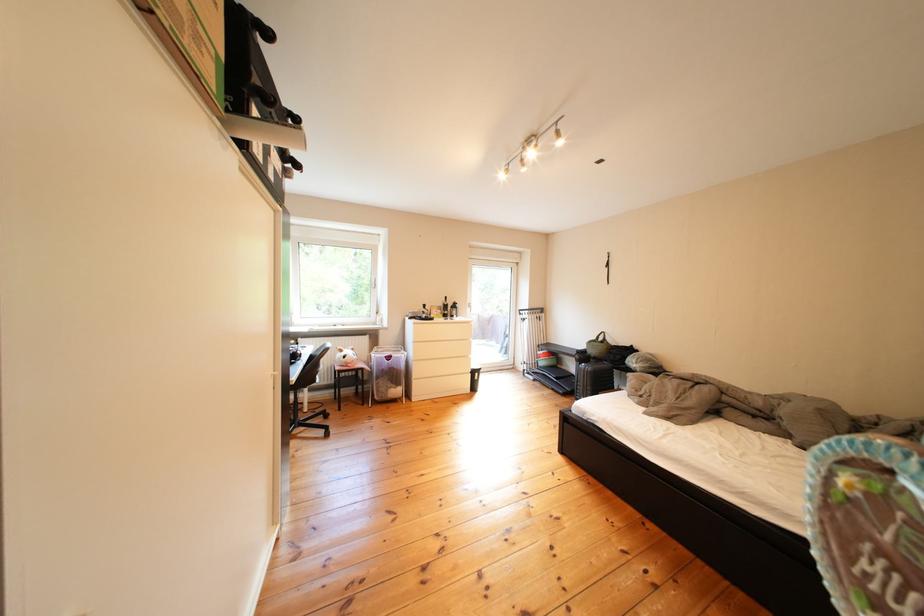
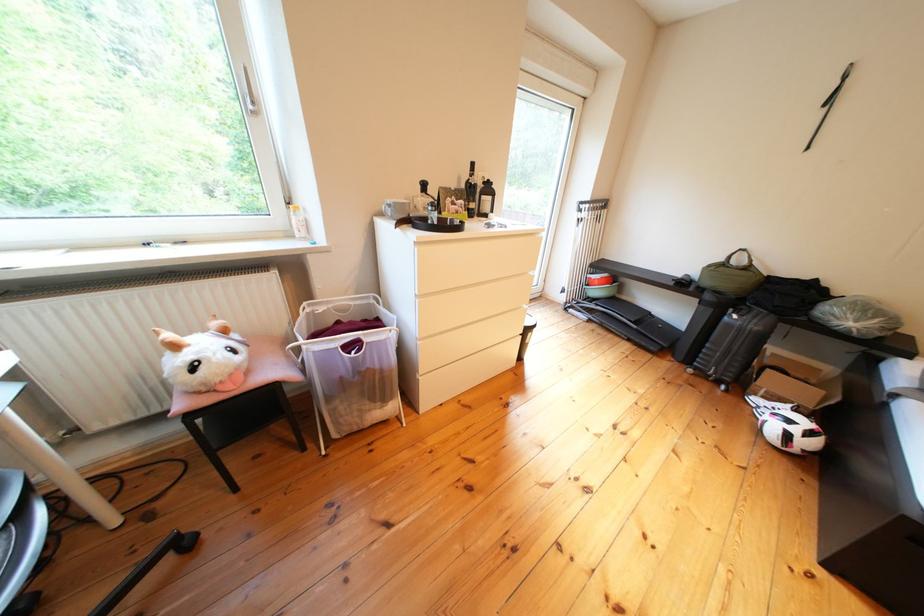
Question: Which direction would the cameraman need to move to produce the second image? Reply with the corresponding letter.

Choices:
 (A) Left
 (B) Right
 (C) Forward
 (D) Backward

Answer: (C)